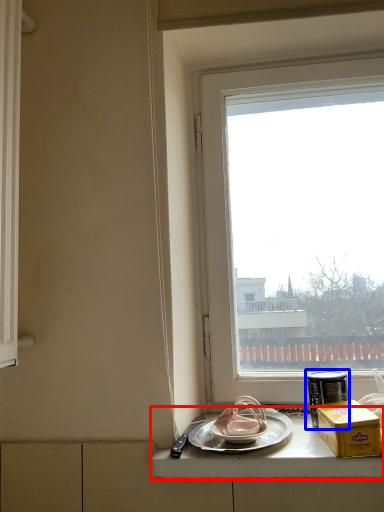
Question: Which object is further to the camera taking this photo, counter top (highlighted by a red box) or tableware (highlighted by a blue box)?

Choices:
 (A) counter top
 (B) tableware

Answer: (B)